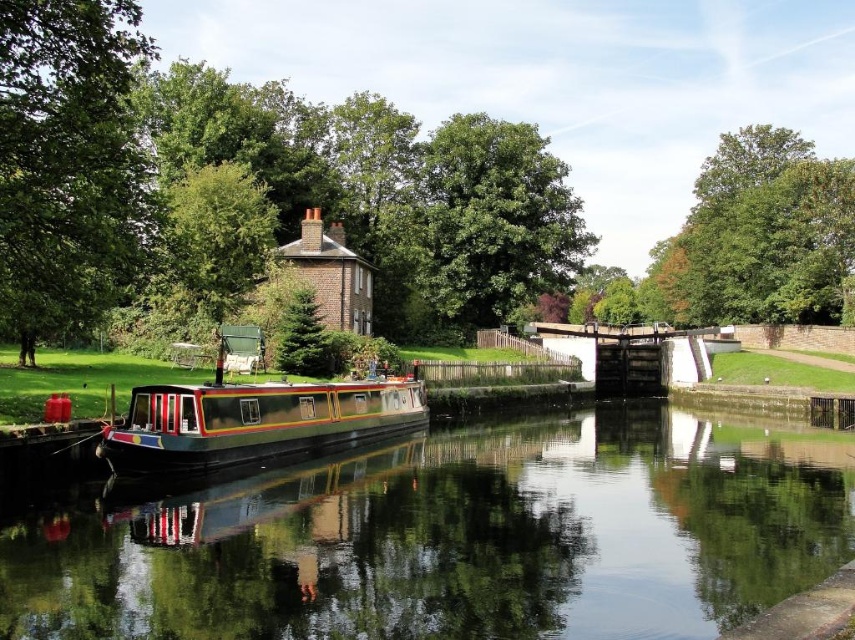
Consider the image. You are standing at the point labeled point [343,413] and want to take a photo of the point labeled point [92,278]. Given that your camera has a maximum focus range of 10 meters, will you be able to capture the point in focus without moving?

Point [92,278] is closer to the camera than point [343,413]. Since you are at point [343,413], the distance between you and the other point is less than 10 meters, so yes, your camera can focus on it.

You are standing at the point with coordinates (254, 189) in the canal scene. What object is located exactly at your current position?

The green leafy tree at upper center is located exactly at the point with coordinates (254, 189).